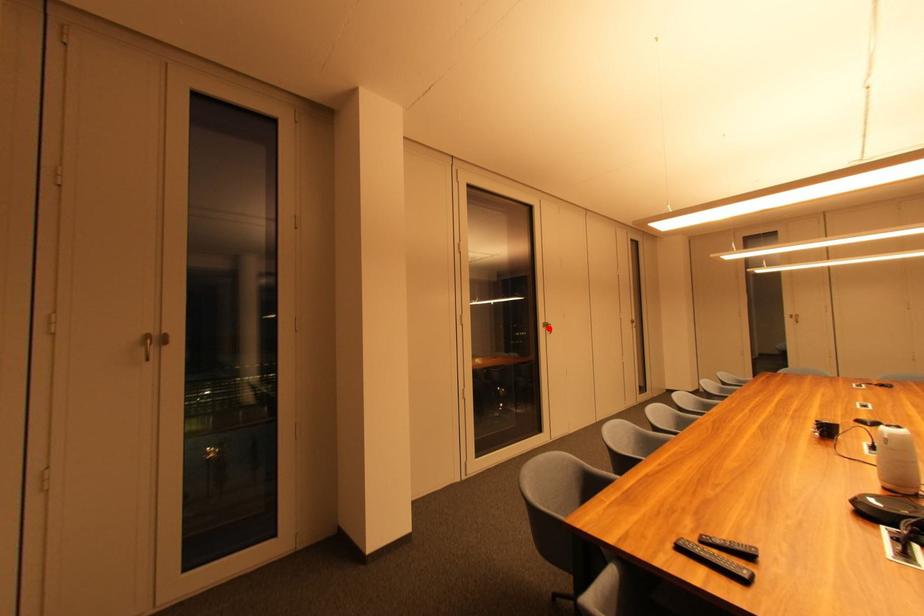
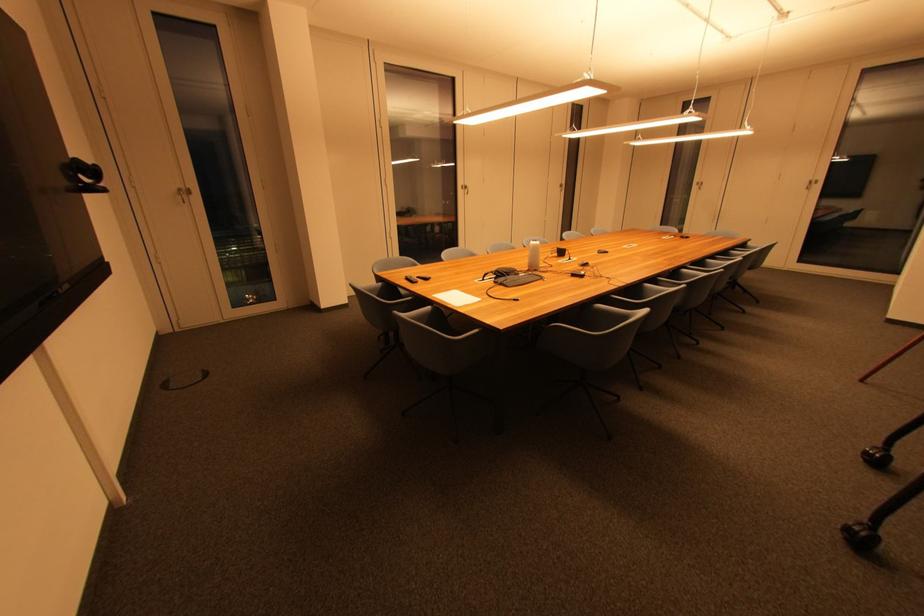
Find the pixel in the second image that matches the highlighted location in the first image.

(468, 190)